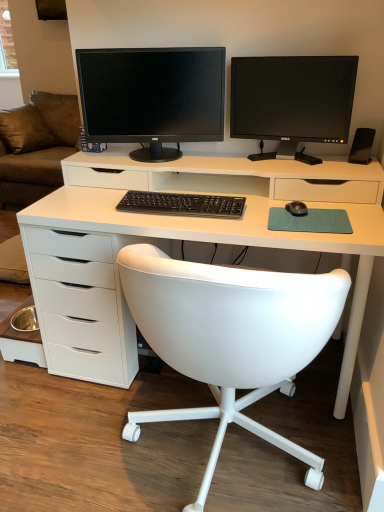
What do you see at coordinates (230, 338) in the screenshot? I see `white leather chair at center` at bounding box center [230, 338].

Where is `black plastic speaker at right`? This screenshot has width=384, height=512. black plastic speaker at right is located at coordinates (362, 146).

Image resolution: width=384 pixels, height=512 pixels. I want to click on black plastic keyboard at center, so pyautogui.click(x=182, y=204).

The image size is (384, 512). I want to click on white matte desk at center, so click(x=224, y=193).

Image resolution: width=384 pixels, height=512 pixels. What are the coordinates of `white leather chair at center` in the screenshot? It's located at (230, 338).

Is brown fabric couch at left inside the boundaries of black plastic speaker at right, or outside?

brown fabric couch at left is outside black plastic speaker at right.

In the scene shown: Considering the relative positions of brown fabric couch at left and black plastic speaker at right in the image provided, is brown fabric couch at left to the right of black plastic speaker at right from the viewer's perspective?

No.

Looking at their sizes, would you say brown fabric couch at left is wider or thinner than black plastic speaker at right?

Clearly, brown fabric couch at left has more width compared to black plastic speaker at right.

Between black glossy monitor at upper right, which is counted as the 1th computer monitor, starting from the right, and black plastic keyboard at center, which one has larger width?

black plastic keyboard at center.

From the image's perspective, which object appears higher, black glossy monitor at upper right, which is counted as the second computer monitor, starting from the left, or black plastic keyboard at center?

black glossy monitor at upper right, which is counted as the second computer monitor, starting from the left, from the image's perspective.

Is black plastic keyboard at center located within black glossy monitor at upper right, which is counted as the 1th computer monitor, starting from the right?

That's incorrect, black plastic keyboard at center is not inside black glossy monitor at upper right, which is counted as the 1th computer monitor, starting from the right.

Consider the image. From a real-world perspective, is black glossy monitor at upper right, which is counted as the 1th computer monitor, starting from the right, positioned above or below black plastic keyboard at center?

In terms of real-world spatial position, black glossy monitor at upper right, which is counted as the 1th computer monitor, starting from the right, is above black plastic keyboard at center.

How many degrees apart are the facing directions of black glossy monitor at upper right, which is counted as the 1th computer monitor, starting from the right, and black glossy monitor at upper center, the 2th computer monitor in the right-to-left sequence?

The facing directions of black glossy monitor at upper right, which is counted as the 1th computer monitor, starting from the right, and black glossy monitor at upper center, the 2th computer monitor in the right-to-left sequence, are 26.3 degrees apart.

Is point (260, 97) more distant than point (142, 96)?

No.

From the image's perspective, is black glossy monitor at upper right, which is counted as the 1th computer monitor, starting from the right, located above or below black glossy monitor at upper center, which is the first computer monitor in left-to-right order?

black glossy monitor at upper right, which is counted as the 1th computer monitor, starting from the right, is situated lower than black glossy monitor at upper center, which is the first computer monitor in left-to-right order, in the image.

From the image's perspective, between black glossy monitor at upper right, which is counted as the second computer monitor, starting from the left, and black plastic speaker at right, who is located below?

black plastic speaker at right is shown below in the image.

Considering the points (324, 119) and (358, 157), which point is behind, point (324, 119) or point (358, 157)?

The point (358, 157) is farther.

Is black glossy monitor at upper right, which is counted as the second computer monitor, starting from the left, taller than black plastic speaker at right?

Yes, black glossy monitor at upper right, which is counted as the second computer monitor, starting from the left, is taller than black plastic speaker at right.

Between point (174, 209) and point (33, 175), which one is positioned in front?

Point (174, 209)

Is black plastic keyboard at center positioned with its back to brown fabric couch at left?

No, black plastic keyboard at center's orientation is not away from brown fabric couch at left.

Does black plastic keyboard at center have a greater height compared to brown fabric couch at left?

No, black plastic keyboard at center is not taller than brown fabric couch at left.

Is black plastic keyboard at center next to brown fabric couch at left?

No, black plastic keyboard at center is not with brown fabric couch at left.

Considering the points (93, 112) and (366, 145), which point is behind, point (93, 112) or point (366, 145)?

The point (93, 112) is farther from the camera.

Considering the relative sizes of black glossy monitor at upper center, the 2th computer monitor in the right-to-left sequence, and black plastic speaker at right in the image provided, is black glossy monitor at upper center, the 2th computer monitor in the right-to-left sequence, bigger than black plastic speaker at right?

Yes, black glossy monitor at upper center, the 2th computer monitor in the right-to-left sequence, is bigger than black plastic speaker at right.

Can you tell me how much black glossy monitor at upper center, the 2th computer monitor in the right-to-left sequence, and black plastic speaker at right differ in facing direction?

The facing directions of black glossy monitor at upper center, the 2th computer monitor in the right-to-left sequence, and black plastic speaker at right are 37.2 degrees apart.

At what (x,y) coordinates should I click in order to perform the action: click on speaker lying behind the black glossy monitor at upper center, the 2th computer monitor in the right-to-left sequence. Please return your answer as a coordinate pair (x, y). This screenshot has height=512, width=384. Looking at the image, I should click on (362, 146).

From the image's perspective, which object appears higher, black glossy monitor at upper center, the 2th computer monitor in the right-to-left sequence, or white leather chair at center?

black glossy monitor at upper center, the 2th computer monitor in the right-to-left sequence, is shown above in the image.

Between black glossy monitor at upper center, which is the first computer monitor in left-to-right order, and white leather chair at center, which one has larger size?

Bigger between the two is white leather chair at center.

What are the coordinates of `the 2nd computer monitor above the white leather chair at center (from a real-world perspective)` in the screenshot? It's located at (152, 97).

How different are the orientations of black glossy monitor at upper center, which is the first computer monitor in left-to-right order, and white leather chair at center in degrees?

73.7 degrees.

This screenshot has height=512, width=384. Identify the location of speaker above the brown fabric couch at left (from a real-world perspective). coord(362,146).

The height and width of the screenshot is (512, 384). Identify the location of computer keyboard on the left of black glossy monitor at upper right, which is counted as the 1th computer monitor, starting from the right. (182, 204).

Looking at the image, which one is located closer to black matte mouse at right, white matte desk at center or black glossy monitor at upper center, the 2th computer monitor in the right-to-left sequence?

→ white matte desk at center is positioned closer to the anchor black matte mouse at right.

When comparing their distances from brown fabric couch at left, does white matte desk at center or black plastic keyboard at center seem closer?

The object closer to brown fabric couch at left is white matte desk at center.

Considering their positions, is black glossy monitor at upper right, which is counted as the second computer monitor, starting from the left, positioned further to white matte desk at center than black matte mouse at right?

black matte mouse at right is positioned further to the anchor white matte desk at center.

Based on their spatial positions, is black glossy monitor at upper center, which is the first computer monitor in left-to-right order, or black plastic keyboard at center closer to black glossy monitor at upper right, which is counted as the second computer monitor, starting from the left?

The object closer to black glossy monitor at upper right, which is counted as the second computer monitor, starting from the left, is black glossy monitor at upper center, which is the first computer monitor in left-to-right order.

Based on their spatial positions, is black plastic speaker at right or black glossy monitor at upper center, which is the first computer monitor in left-to-right order, closer to white matte desk at center?

black glossy monitor at upper center, which is the first computer monitor in left-to-right order.

Looking at the image, which one is located further to black glossy monitor at upper center, which is the first computer monitor in left-to-right order, black plastic speaker at right or black plastic keyboard at center?

black plastic speaker at right.

Considering their positions, is black plastic speaker at right positioned further to black matte mouse at right than brown fabric couch at left?

brown fabric couch at left is positioned further to the anchor black matte mouse at right.

When comparing their distances from black matte mouse at right, does white leather chair at center or black plastic speaker at right seem closer?

black plastic speaker at right lies closer to black matte mouse at right than the other object.

Identify the location of desk located between black plastic keyboard at center and black plastic speaker at right in the left-right direction. This screenshot has width=384, height=512. (224, 193).

Image resolution: width=384 pixels, height=512 pixels. I want to click on mouse situated between black plastic keyboard at center and black plastic speaker at right from left to right, so click(297, 208).

Find the location of a particular element. This screenshot has width=384, height=512. computer keyboard between black glossy monitor at upper center, the 2th computer monitor in the right-to-left sequence, and white matte desk at center in the up-down direction is located at coordinates (182, 204).

Locate an element on the screen. The height and width of the screenshot is (512, 384). computer monitor situated between black glossy monitor at upper center, the 2th computer monitor in the right-to-left sequence, and black matte mouse at right from left to right is located at coordinates (292, 100).